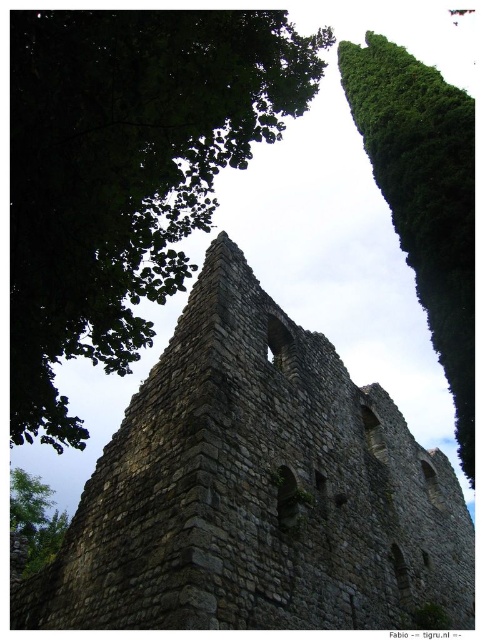
You are standing in front of the stone structure and notice two points marked on the image. One is at coordinates point (211,346) and the other is at point (457,209). Which point is closer to you?

Point (211,346) is closer to the viewer than point (457,209).

You are an architect examining this ancient structure. You notice the stone wall at center and the green leafy tree at upper left. Which object is positioned higher in the image?

The green leafy tree at upper left is higher in the image since the stone wall at center is below it.